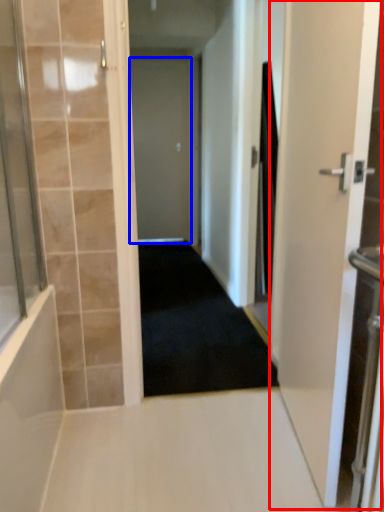
Question: Which object appears closest to the camera in this image, door (highlighted by a red box) or door (highlighted by a blue box)?

Choices:
 (A) door
 (B) door

Answer: (A)